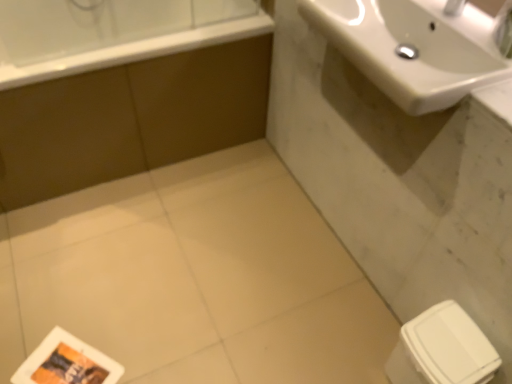
Question: Considering the relative positions of white glossy sink at upper right and brown matte bathtub at upper left in the image provided, is white glossy sink at upper right in front of brown matte bathtub at upper left?

Choices:
 (A) yes
 (B) no

Answer: (A)

Question: Considering the relative sizes of white glossy sink at upper right and brown matte bathtub at upper left in the image provided, is white glossy sink at upper right shorter than brown matte bathtub at upper left?

Choices:
 (A) yes
 (B) no

Answer: (A)

Question: Can you confirm if white glossy sink at upper right is thinner than brown matte bathtub at upper left?

Choices:
 (A) no
 (B) yes

Answer: (B)

Question: Is white glossy sink at upper right wider than brown matte bathtub at upper left?

Choices:
 (A) yes
 (B) no

Answer: (B)

Question: Can we say white glossy sink at upper right lies outside brown matte bathtub at upper left?

Choices:
 (A) yes
 (B) no

Answer: (A)

Question: Is point (122, 13) closer or farther from the camera than point (203, 77)?

Choices:
 (A) farther
 (B) closer

Answer: (A)

Question: Is white glossy bathtub at upper left taller or shorter than brown matte bathtub at upper left?

Choices:
 (A) short
 (B) tall

Answer: (A)

Question: In terms of size, does white glossy bathtub at upper left appear bigger or smaller than brown matte bathtub at upper left?

Choices:
 (A) big
 (B) small

Answer: (B)

Question: From the image's perspective, is white glossy bathtub at upper left located above or below brown matte bathtub at upper left?

Choices:
 (A) below
 (B) above

Answer: (B)

Question: From the image's perspective, is brown matte bathtub at upper left positioned above or below white glossy sink at upper right?

Choices:
 (A) above
 (B) below

Answer: (A)

Question: Considering the positions of brown matte bathtub at upper left and white glossy sink at upper right in the image, is brown matte bathtub at upper left taller or shorter than white glossy sink at upper right?

Choices:
 (A) tall
 (B) short

Answer: (A)

Question: Visually, is brown matte bathtub at upper left positioned to the left or to the right of white glossy sink at upper right?

Choices:
 (A) left
 (B) right

Answer: (A)

Question: From a real-world perspective, is brown matte bathtub at upper left physically located above or below white glossy sink at upper right?

Choices:
 (A) below
 (B) above

Answer: (A)

Question: Is white glossy sink at upper right in front of or behind brown matte bathtub at upper left in the image?

Choices:
 (A) behind
 (B) front

Answer: (B)

Question: Considering the positions of white glossy sink at upper right and brown matte bathtub at upper left in the image, is white glossy sink at upper right wider or thinner than brown matte bathtub at upper left?

Choices:
 (A) thin
 (B) wide

Answer: (A)